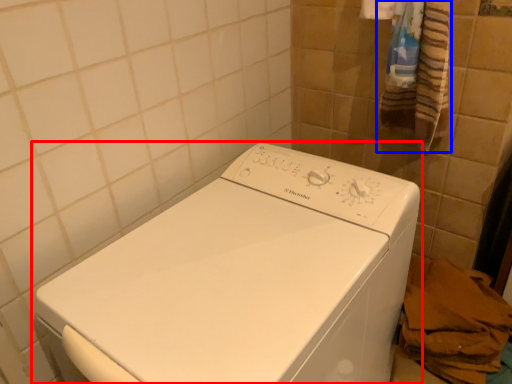
Question: Which object appears farthest to the camera in this image, washing machine (highlighted by a red box) or bath towel (highlighted by a blue box)?

Choices:
 (A) washing machine
 (B) bath towel

Answer: (B)